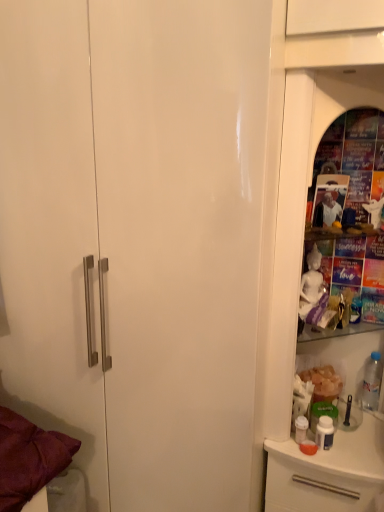
Question: Is white glossy dresser at right wider or thinner than translucent plastic bottle at right?

Choices:
 (A) thin
 (B) wide

Answer: (B)

Question: Is white glossy dresser at right in front of or behind translucent plastic bottle at right in the image?

Choices:
 (A) behind
 (B) front

Answer: (B)

Question: In the image, is white glossy dresser at right on the left side or the right side of translucent plastic bottle at right?

Choices:
 (A) right
 (B) left

Answer: (B)

Question: From a real-world perspective, is translucent plastic bottle at right positioned above or below white glossy dresser at right?

Choices:
 (A) below
 (B) above

Answer: (A)

Question: Looking at their shapes, would you say translucent plastic bottle at right is wider or thinner than white glossy dresser at right?

Choices:
 (A) wide
 (B) thin

Answer: (B)

Question: Is translucent plastic bottle at right taller or shorter than white glossy dresser at right?

Choices:
 (A) tall
 (B) short

Answer: (B)

Question: Is translucent plastic bottle at right bigger or smaller than white glossy dresser at right?

Choices:
 (A) big
 (B) small

Answer: (B)